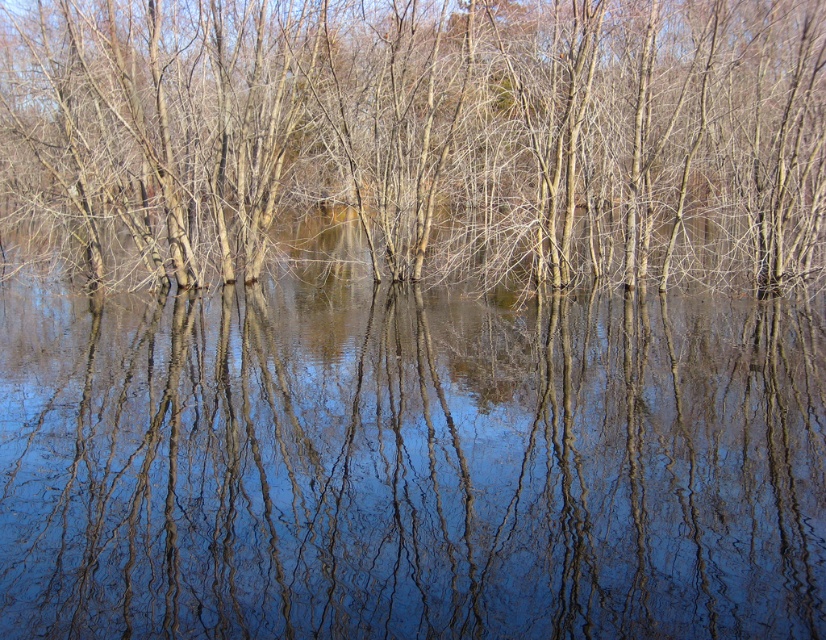
Question: Considering the relative positions of transparent water at center and brown matte tree at center in the image provided, where is transparent water at center located with respect to brown matte tree at center?

Choices:
 (A) above
 (B) below

Answer: (B)

Question: Does transparent water at center have a smaller size compared to brown matte tree at center?

Choices:
 (A) yes
 (B) no

Answer: (B)

Question: Which object is closer to the camera taking this photo?

Choices:
 (A) brown matte tree at center
 (B) transparent water at center

Answer: (B)

Question: Which point is closer to the camera?

Choices:
 (A) (55, 602)
 (B) (221, 16)

Answer: (A)

Question: Does transparent water at center appear under brown matte tree at center?

Choices:
 (A) no
 (B) yes

Answer: (B)